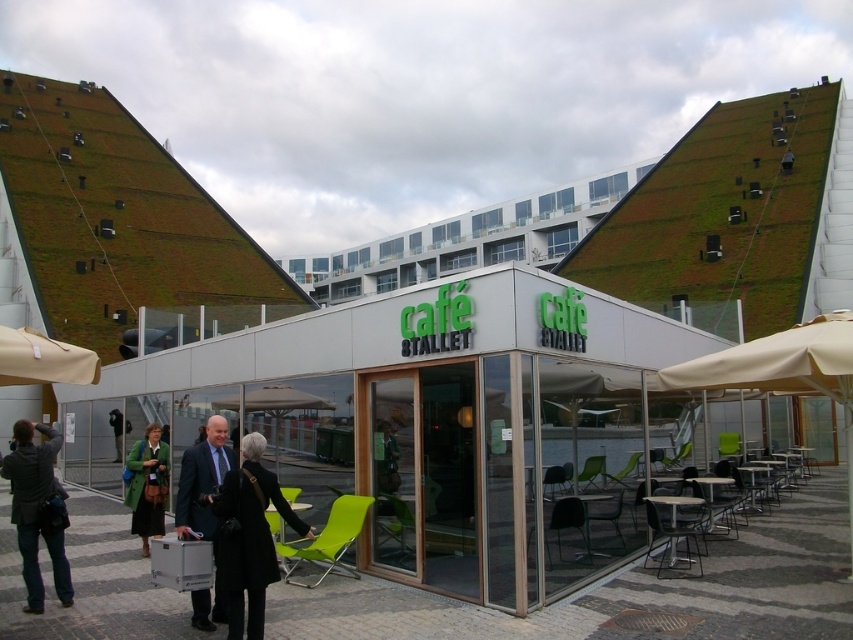
Between green fabric chair at center and green plastic chair at lower center, which one has less height?

With less height is green plastic chair at lower center.

Can you confirm if green fabric chair at center is shorter than green plastic chair at lower center?

No, green fabric chair at center is not shorter than green plastic chair at lower center.

Does point (352, 524) come closer to viewer compared to point (578, 486)?

Yes, it is in front of point (578, 486).

At what (x,y) coordinates should I click in order to perform the action: click on green fabric chair at center. Please return your answer as a coordinate pair (x, y). This screenshot has width=853, height=640. Looking at the image, I should click on [x=328, y=538].

Which is more to the left, black plastic chair at lower center or green plastic chair at lower center?

black plastic chair at lower center

Is black plastic chair at lower center below green plastic chair at lower center?

Yes, black plastic chair at lower center is below green plastic chair at lower center.

Is point (544, 532) behind point (581, 480)?

No, (544, 532) is closer to viewer.

Where is `black plastic chair at lower center`? The image size is (853, 640). black plastic chair at lower center is located at coordinates (566, 525).

Is point (416, 426) more distant than point (576, 528)?

No, (416, 426) is closer to viewer.

The height and width of the screenshot is (640, 853). Describe the element at coordinates (431, 420) in the screenshot. I see `white glass cafe at center` at that location.

At what (x,y) coordinates should I click in order to perform the action: click on white glass cafe at center. Please return your answer as a coordinate pair (x, y). This screenshot has width=853, height=640. Looking at the image, I should click on (431, 420).

You are a GUI agent. You are given a task and a screenshot of the screen. Output one action in this format:
    pyautogui.click(x=<x>, y=<y>)
    Task: Click on the white glass cafe at center
    
    Given the screenshot: What is the action you would take?
    pyautogui.click(x=431, y=420)